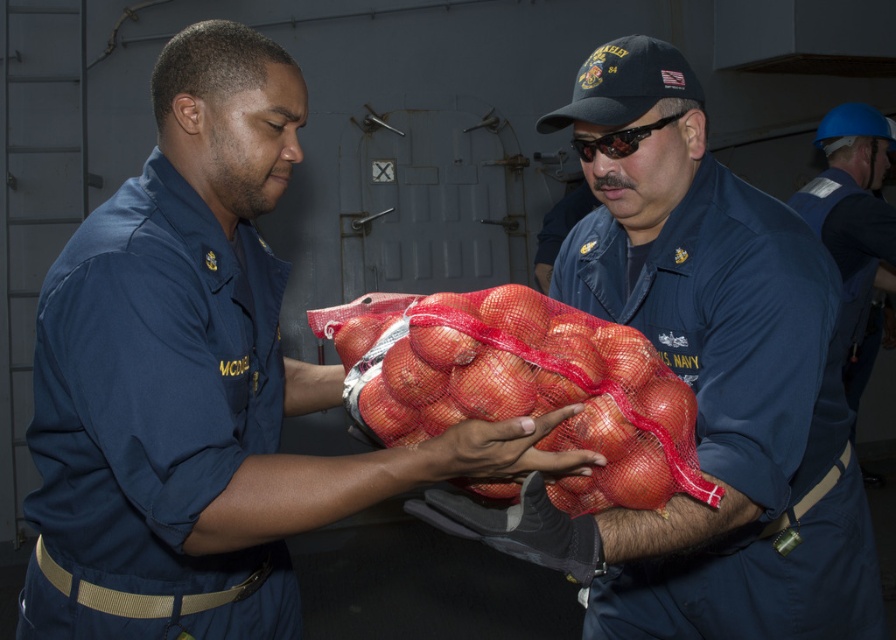
Question: Does blue fabric uniform at center appear on the right side of red mesh bag of onions at center?

Choices:
 (A) yes
 (B) no

Answer: (A)

Question: Is navy blue fabric uniform at left bigger than red mesh bag of onions at center?

Choices:
 (A) no
 (B) yes

Answer: (B)

Question: Which object is the farthest from the blue uniform at center?

Choices:
 (A) red mesh bag of onions at center
 (B) blue fabric uniform at right
 (C) blue fabric uniform at center
 (D) navy blue fabric uniform at left

Answer: (B)

Question: Among these points, which one is nearest to the camera?

Choices:
 (A) (203, 563)
 (B) (419, 397)
 (C) (678, 620)

Answer: (B)

Question: Which of the following is the closest to the observer?

Choices:
 (A) blue fabric uniform at center
 (B) navy blue fabric uniform at left
 (C) blue uniform at center
 (D) blue fabric uniform at right

Answer: (C)

Question: Does blue fabric uniform at center appear over blue fabric uniform at right?

Choices:
 (A) no
 (B) yes

Answer: (A)